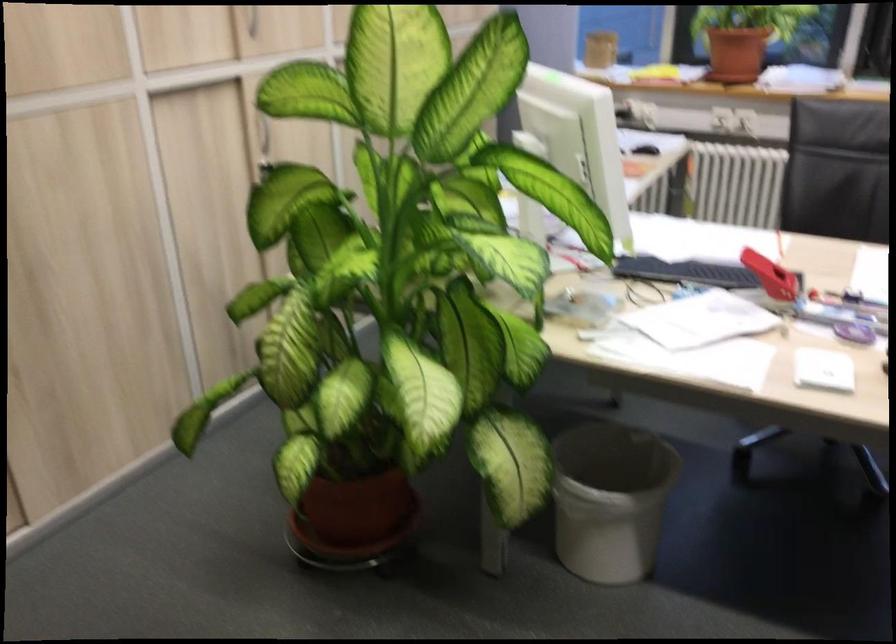
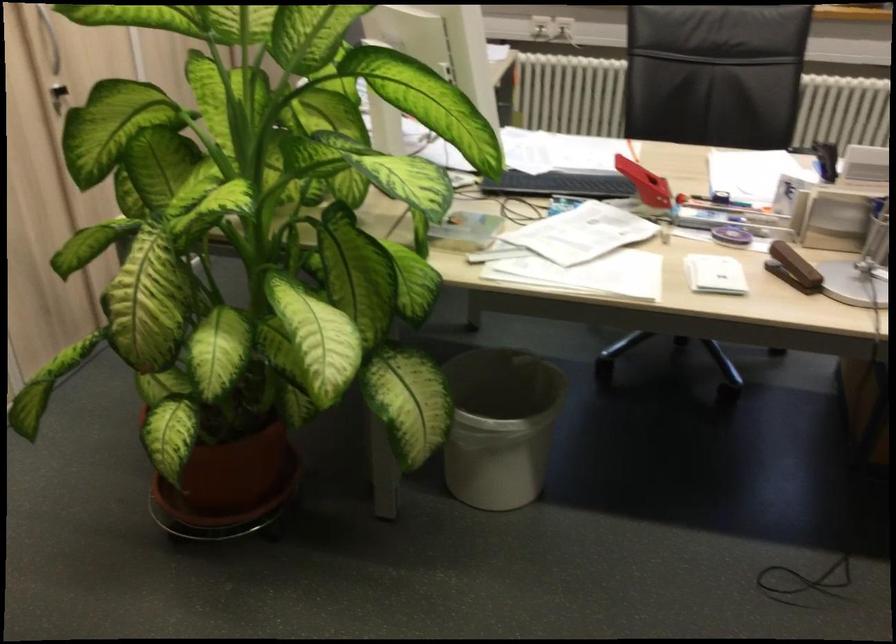
The point at (602, 498) is marked in the first image. Where is the corresponding point in the second image?

(500, 426)